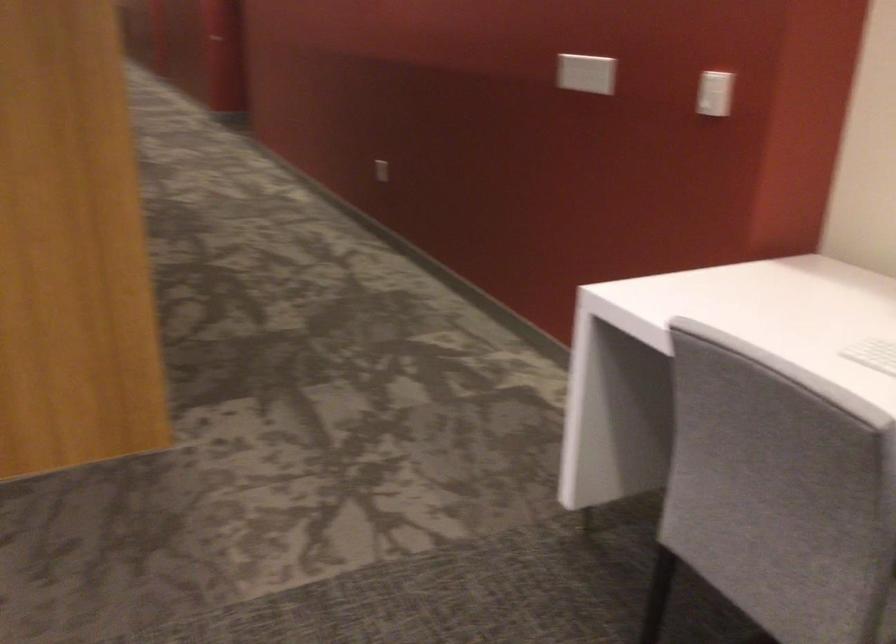
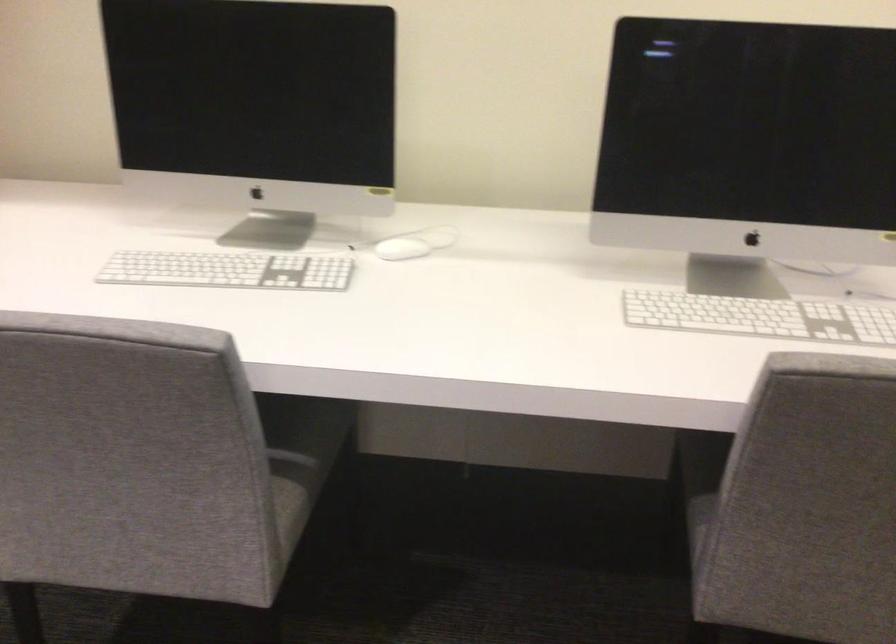
How did the camera likely rotate?

The camera rotated toward right-down.